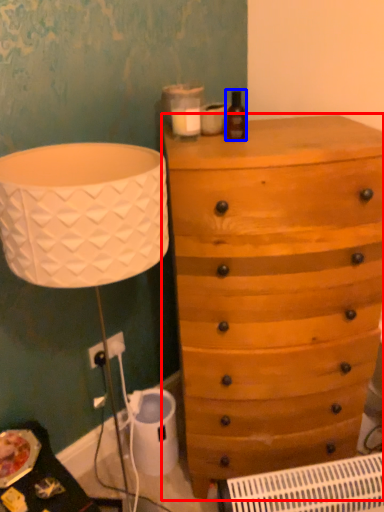
Question: Which object is closer to the camera taking this photo, chest of drawers (highlighted by a red box) or bottle (highlighted by a blue box)?

Choices:
 (A) chest of drawers
 (B) bottle

Answer: (A)